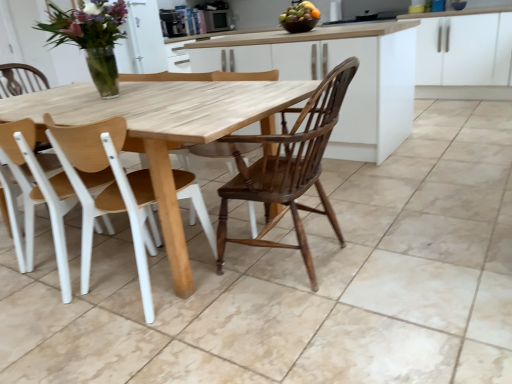
This screenshot has width=512, height=384. Find the location of `free location in front of wooden at center, the 2th chair viewed from the left`. free location in front of wooden at center, the 2th chair viewed from the left is located at coordinates (135, 341).